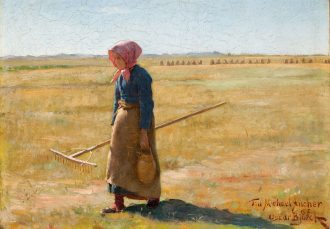
The height and width of the screenshot is (229, 330). Identify the location of painting. (225, 110).